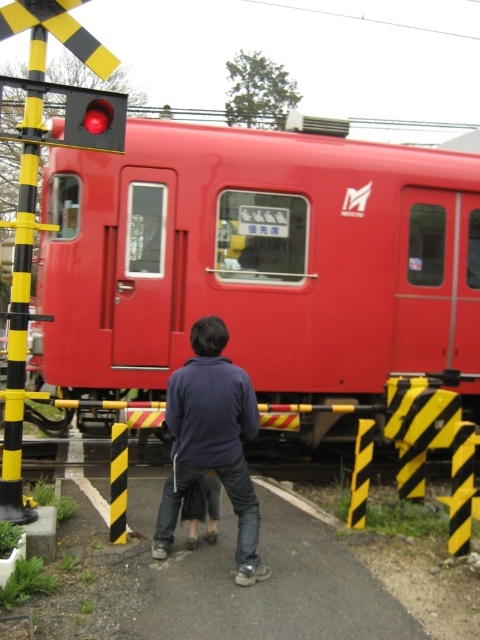
Between yellow/black striped pole at left and matte red button at upper left, which one has more height?

Standing taller between the two is yellow/black striped pole at left.

Who is more distant from viewer, (x=20, y=465) or (x=74, y=97)?

The point (x=74, y=97) is more distant.

Which is behind, point (29, 97) or point (90, 112)?

Point (90, 112)

You are a GUI agent. You are given a task and a screenshot of the screen. Output one action in this format:
    pyautogui.click(x=<x>, y=<y>)
    Task: Click on the yellow/black striped pole at left
    The image size is (480, 640).
    Given the screenshot: What is the action you would take?
    pyautogui.click(x=20, y=314)

How much distance is there between dark blue fleece at center and yellow/black striped pole at left?

dark blue fleece at center and yellow/black striped pole at left are 2.25 meters apart.

Can you confirm if dark blue fleece at center is thinner than yellow/black striped pole at left?

No.

This screenshot has width=480, height=640. What do you see at coordinates (212, 442) in the screenshot?
I see `dark blue fleece at center` at bounding box center [212, 442].

Find the location of a particular element. dark blue fleece at center is located at coordinates (212, 442).

Does red matte train at center have a larger size compared to yellow/black striped pole at left?

Correct, red matte train at center is larger in size than yellow/black striped pole at left.

Is red matte train at center smaller than yellow/black striped pole at left?

Incorrect, red matte train at center is not smaller in size than yellow/black striped pole at left.

Is point (389, 234) more distant than point (31, 58)?

Yes.

You are a GUI agent. You are given a task and a screenshot of the screen. Output one action in this format:
    pyautogui.click(x=<x>, y=<y>)
    Task: Click on the red matte train at center
    
    Given the screenshot: What is the action you would take?
    pyautogui.click(x=259, y=262)